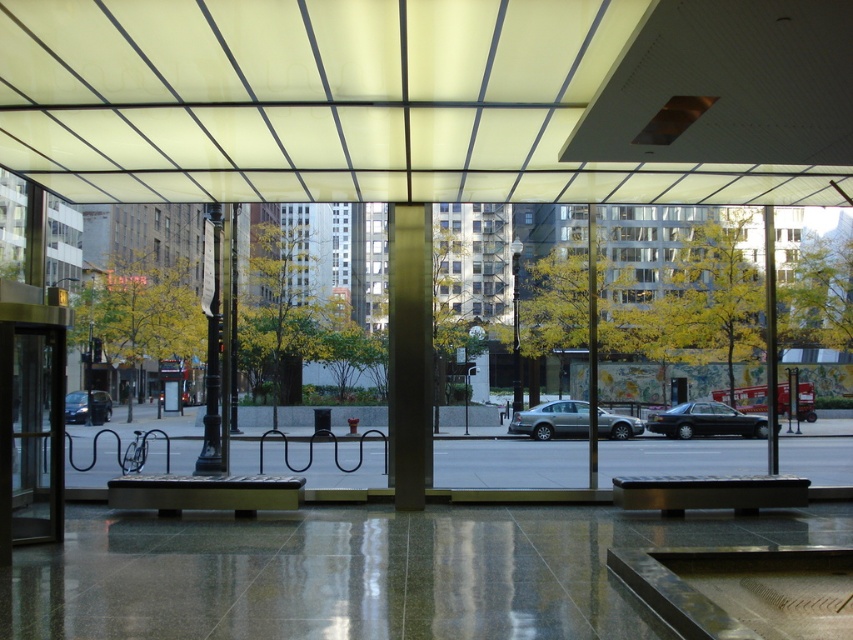
Is point (395, 228) positioned in front of point (718, 413)?

Yes, it is.

Can you confirm if satin silver column at center is smaller than shiny black sedan at center?

Correct, satin silver column at center occupies less space than shiny black sedan at center.

Who is more forward, (395,348) or (761,432)?

Point (395,348)

Find the location of a particular element. The width and height of the screenshot is (853, 640). satin silver column at center is located at coordinates (409, 353).

Who is more forward, (560,401) or (86,412)?

Point (560,401) is in front.

Does satin silver sedan at center have a larger size compared to matte black car at left?

Actually, satin silver sedan at center might be smaller than matte black car at left.

Which is behind, point (608, 426) or point (74, 404)?

The point (74, 404) is behind.

Identify the location of satin silver sedan at center. The height and width of the screenshot is (640, 853). (552, 419).

Can you confirm if satin silver column at center is bigger than satin silver sedan at center?

Actually, satin silver column at center might be smaller than satin silver sedan at center.

Between satin silver column at center and satin silver sedan at center, which one is positioned lower?

Positioned lower is satin silver sedan at center.

You are a GUI agent. You are given a task and a screenshot of the screen. Output one action in this format:
    pyautogui.click(x=<x>, y=<y>)
    Task: Click on the satin silver column at center
    This screenshot has width=853, height=640.
    Given the screenshot: What is the action you would take?
    pyautogui.click(x=409, y=353)

Find the location of a particular element. The image size is (853, 640). satin silver column at center is located at coordinates (409, 353).